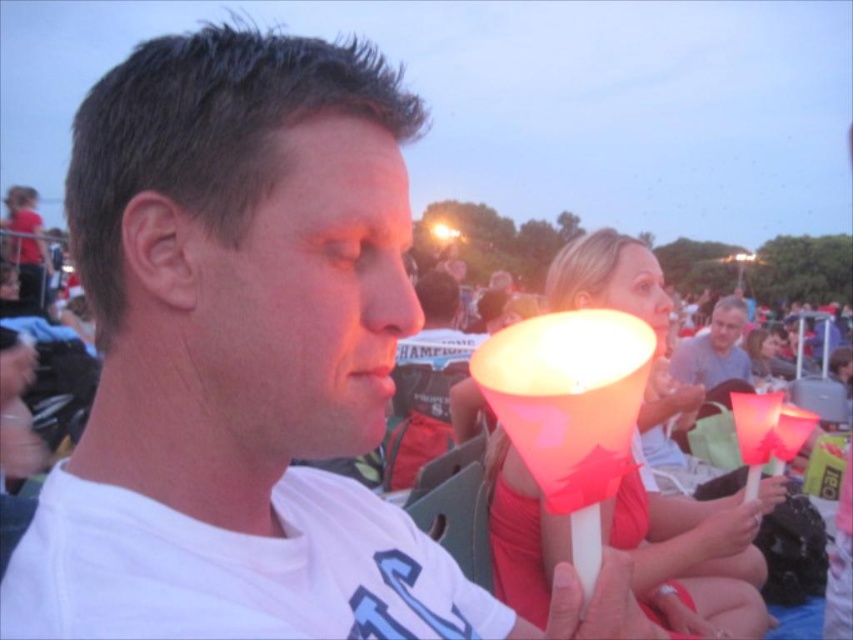
You are standing at the point with coordinates point (740, 301) and want to walk to the point with coordinates point (583, 483). Which direction should you move in relative to the other point?

You should move towards the point (583, 483), which is in front of point (740, 301).

You are standing at the origin point of the coordinate system in the image. You want to place a new object at the position of the translucent plastic lamp at center. What are the coordinates where you should place the new object?

The coordinates for the translucent plastic lamp at center are at point [569,410], so you should place the new object at those coordinates.